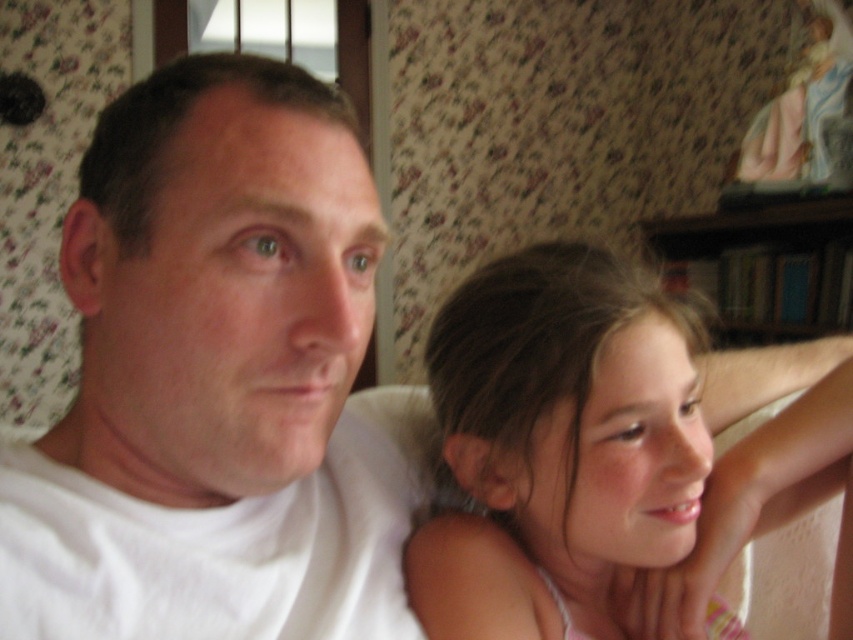
You are a photographer adjusting the focus of your camera. You need to ensure that both the white matte shirt at upper left and the light brown hair at center are in focus. The camera can only focus on objects within a 5.5 inch range. Can both objects be in focus simultaneously?

The white matte shirt at upper left is 5.92 inches away from the light brown hair at center. Since the distance between them exceeds the camera focus range of 5.5 inches, both objects cannot be in focus at the same time.

You are an artist trying to sketch the scene. You notice the light brown hair at center and the smooth skin face at center. Which object is closer to the viewer?

The light brown hair at center is closer to the viewer than the smooth skin face at center.